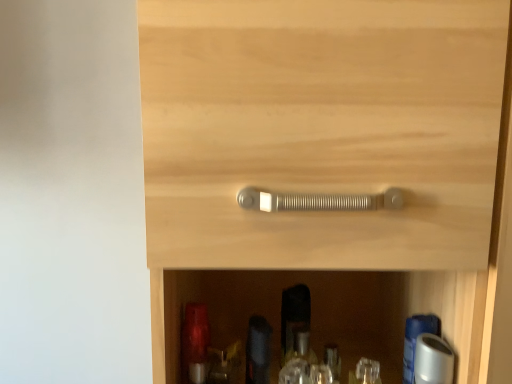
Question: Is clear plastic bottle at lower center, the third bottle from the left, thinner than matte silver handle at center?

Choices:
 (A) yes
 (B) no

Answer: (A)

Question: From a real-world perspective, is clear plastic bottle at lower center, the third bottle from the left, on top of matte silver handle at center?

Choices:
 (A) yes
 (B) no

Answer: (B)

Question: Can you confirm if clear plastic bottle at lower center, the second bottle in the right-to-left sequence, is bigger than matte silver handle at center?

Choices:
 (A) yes
 (B) no

Answer: (B)

Question: Can you confirm if clear plastic bottle at lower center, the third bottle from the left, is smaller than matte silver handle at center?

Choices:
 (A) no
 (B) yes

Answer: (B)

Question: Is clear plastic bottle at lower center, the second bottle in the right-to-left sequence, not within matte silver handle at center?

Choices:
 (A) no
 (B) yes

Answer: (A)

Question: From a real-world perspective, is clear plastic bottle at lower center, the third bottle from the left, beneath matte silver handle at center?

Choices:
 (A) yes
 (B) no

Answer: (A)

Question: Considering the relative sizes of matte red glass bottle at lower left, the first bottle from the left, and clear plastic bottle at lower center, the third bottle from the left, in the image provided, is matte red glass bottle at lower left, the first bottle from the left, thinner than clear plastic bottle at lower center, the third bottle from the left,?

Choices:
 (A) yes
 (B) no

Answer: (B)

Question: From a real-world perspective, is matte red glass bottle at lower left, which is the 4th bottle from right to left, located higher than clear plastic bottle at lower center, the third bottle from the left?

Choices:
 (A) no
 (B) yes

Answer: (B)

Question: Is matte red glass bottle at lower left, which is the 4th bottle from right to left, bigger than clear plastic bottle at lower center, the third bottle from the left?

Choices:
 (A) yes
 (B) no

Answer: (A)

Question: Is matte red glass bottle at lower left, which is the 4th bottle from right to left, closer to camera compared to clear plastic bottle at lower center, the third bottle from the left?

Choices:
 (A) no
 (B) yes

Answer: (B)

Question: Would you say matte red glass bottle at lower left, which is the 4th bottle from right to left, is outside clear plastic bottle at lower center, the second bottle in the right-to-left sequence?

Choices:
 (A) no
 (B) yes

Answer: (B)

Question: From the image's perspective, is matte red glass bottle at lower left, the first bottle from the left, located beneath clear plastic bottle at lower center, the third bottle from the left?

Choices:
 (A) no
 (B) yes

Answer: (A)

Question: Does clear plastic bottle at lower center, the third bottle from the left, have a lesser width compared to matte red glass bottle at lower left, which is the 4th bottle from right to left?

Choices:
 (A) yes
 (B) no

Answer: (A)